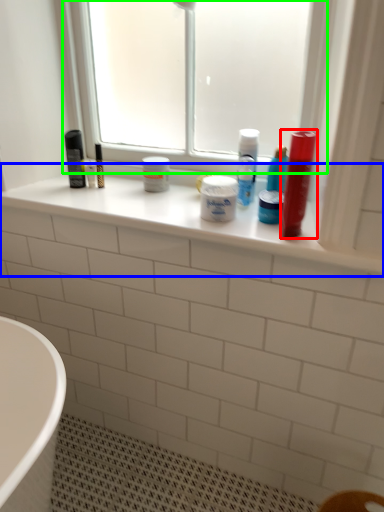
Question: Based on their relative distances, which object is nearer to mouthwash (highlighted by a red box)? Choose from window sill (highlighted by a blue box) and window (highlighted by a green box).

Choices:
 (A) window sill
 (B) window

Answer: (A)